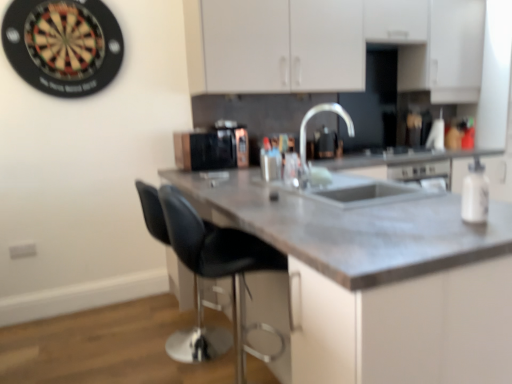
Question: Considering the positions of point (307, 117) and point (433, 76), is point (307, 117) closer or farther from the camera than point (433, 76)?

Choices:
 (A) farther
 (B) closer

Answer: (B)

Question: From the image's perspective, is satin nickel faucet at center above or below white matte cabinet at upper center?

Choices:
 (A) below
 (B) above

Answer: (A)

Question: Which object is the closest to the white matte cabinet at upper center?

Choices:
 (A) matte gray countertop at center
 (B) white matte bottle at right
 (C) black matte microwave at center
 (D) black leather stool at center
 (E) satin nickel faucet at center

Answer: (E)

Question: Estimate the real-world distances between objects in this image. Which object is farther from the white matte cabinet at upper center?

Choices:
 (A) satin nickel faucet at center
 (B) black matte microwave at center
 (C) black leather stool at center
 (D) black leather swivel chair at lower left
 (E) white matte bottle at right

Answer: (E)